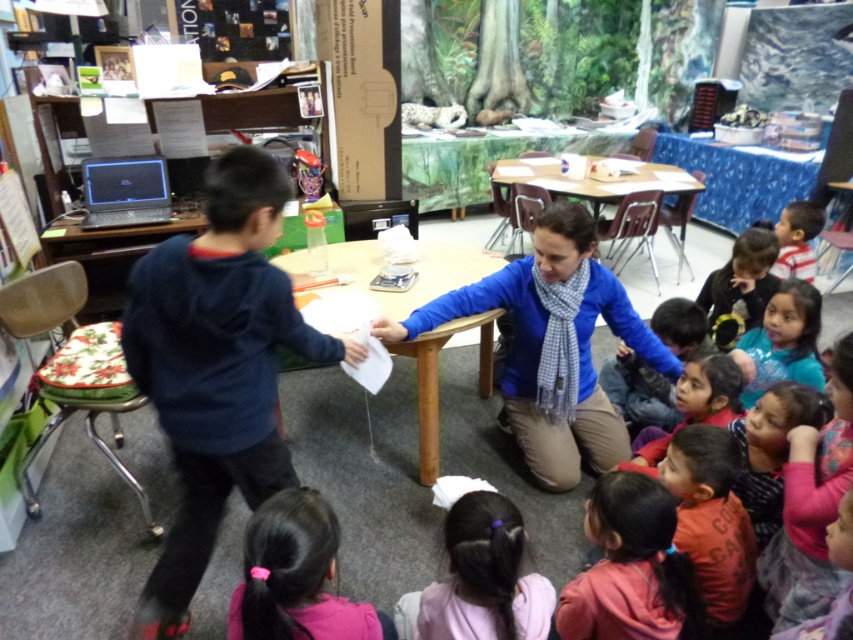
Based on the photo, you are a student in the classroom and want to hand your homework to the teacher. The teacher is standing near the dark blue sweater at lower right. You are currently near the pink fabric ponytail at lower center. Which direction should you move to reach the teacher?

You should move towards the dark blue sweater at lower right from the pink fabric ponytail at lower center. Since the pink fabric ponytail at lower center is closer to the viewer, moving towards the dark blue sweater at lower right would mean moving away from your current position towards the teacher.

You are a teacher in the classroom and you need to locate the pink fabric ponytail at lower center and the dark blue sweater at lower right. Which object is positioned lower in the image?

The pink fabric ponytail at lower center is positioned below the dark blue sweater at lower right, so it is lower in the image.